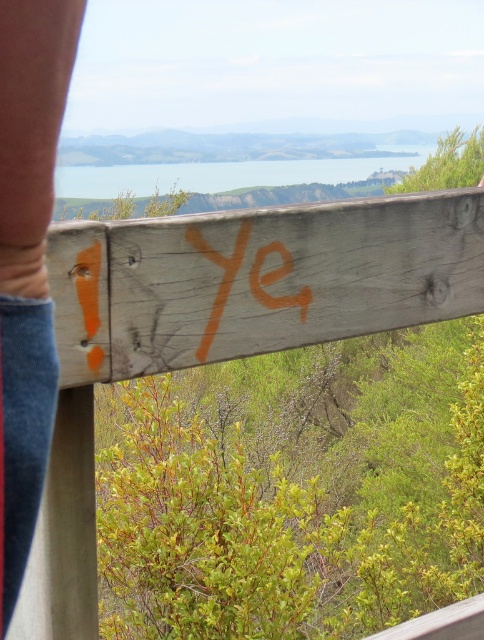
Question: Which point is closer to the camera?

Choices:
 (A) (230, 260)
 (B) (21, 339)

Answer: (B)

Question: Can you confirm if smooth skin arm at upper left is positioned above orange painted lettering at center?

Choices:
 (A) no
 (B) yes

Answer: (A)

Question: Which point is closer to the camera?

Choices:
 (A) smooth skin arm at upper left
 (B) orange painted lettering at center

Answer: (A)

Question: Observing the image, what is the correct spatial positioning of smooth skin arm at upper left in reference to orange painted lettering at center?

Choices:
 (A) above
 (B) below

Answer: (B)

Question: Which point is closer to the camera?

Choices:
 (A) (21, 97)
 (B) (236, 257)

Answer: (A)

Question: Is smooth skin arm at upper left smaller than orange painted lettering at center?

Choices:
 (A) no
 (B) yes

Answer: (A)